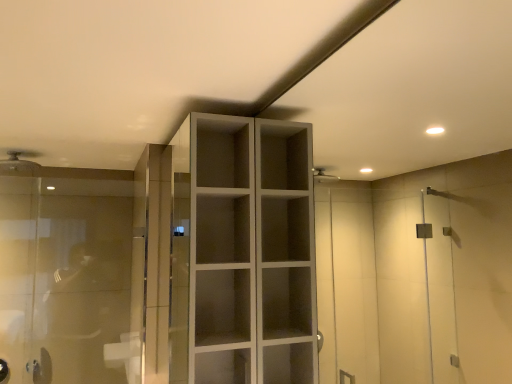
Question: From the image's perspective, is transparent glass door at left on matte white cupboard at center?

Choices:
 (A) no
 (B) yes

Answer: (A)

Question: Is transparent glass door at left placed right next to matte white cupboard at center?

Choices:
 (A) yes
 (B) no

Answer: (B)

Question: Is transparent glass door at left oriented away from matte white cupboard at center?

Choices:
 (A) no
 (B) yes

Answer: (A)

Question: Does transparent glass door at left have a lesser height compared to matte white cupboard at center?

Choices:
 (A) yes
 (B) no

Answer: (B)

Question: Is transparent glass door at left wider than matte white cupboard at center?

Choices:
 (A) yes
 (B) no

Answer: (B)

Question: From a real-world perspective, relative to matte white shower head at upper left, is transparent glass door at left vertically above or below?

Choices:
 (A) above
 (B) below

Answer: (B)

Question: From their relative heights in the image, would you say transparent glass door at left is taller or shorter than matte white shower head at upper left?

Choices:
 (A) short
 (B) tall

Answer: (B)

Question: Visually, is transparent glass door at left positioned to the left or to the right of matte white shower head at upper left?

Choices:
 (A) left
 (B) right

Answer: (B)

Question: From the image's perspective, is transparent glass door at left positioned above or below matte white shower head at upper left?

Choices:
 (A) above
 (B) below

Answer: (B)

Question: Relative to matte white cupboard at center, is transparent glass door at left in front or behind?

Choices:
 (A) front
 (B) behind

Answer: (B)

Question: From the image's perspective, is transparent glass door at left above or below matte white cupboard at center?

Choices:
 (A) below
 (B) above

Answer: (A)

Question: Looking at their shapes, would you say transparent glass door at left is wider or thinner than matte white cupboard at center?

Choices:
 (A) wide
 (B) thin

Answer: (B)

Question: Considering the positions of point (128, 304) and point (293, 273), is point (128, 304) closer or farther from the camera than point (293, 273)?

Choices:
 (A) closer
 (B) farther

Answer: (B)

Question: Is point (5, 168) positioned closer to the camera than point (280, 147)?

Choices:
 (A) closer
 (B) farther

Answer: (B)

Question: Is matte white shower head at upper left wider or thinner than matte white cupboard at center?

Choices:
 (A) thin
 (B) wide

Answer: (B)